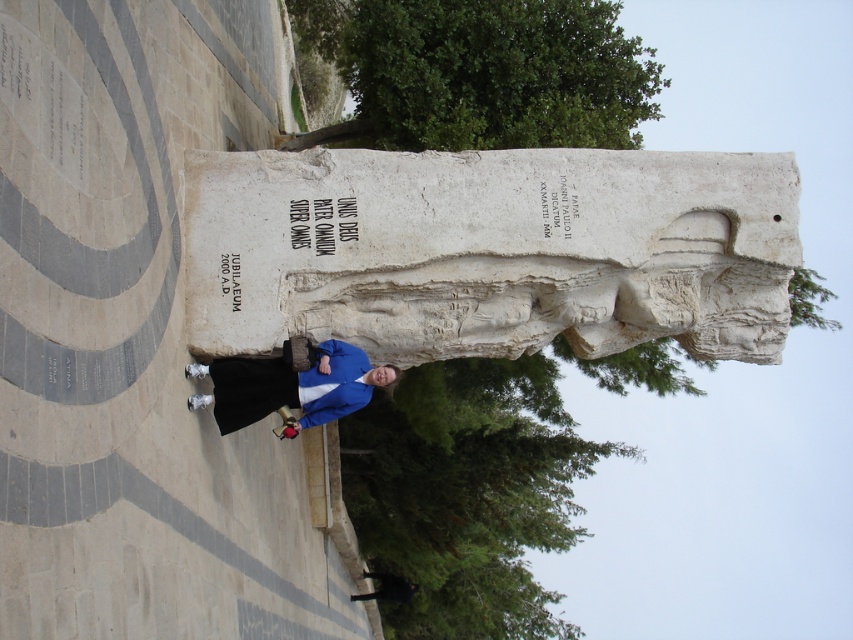
What is the relationship between the size of the white stone sculpture at center and the black fabric jacket at lower center?

The white stone sculpture at center is wider than the black fabric jacket at lower center.

You are standing in front of the monument and want to take a photo of the white stone statue at center. If your camera can focus on objects up to 30 meters away, will it be able to capture the statue clearly?

The white stone statue at center is 30.83 meters from viewer, which is beyond the camera focus range of 30 meters. The statue will not be captured clearly.